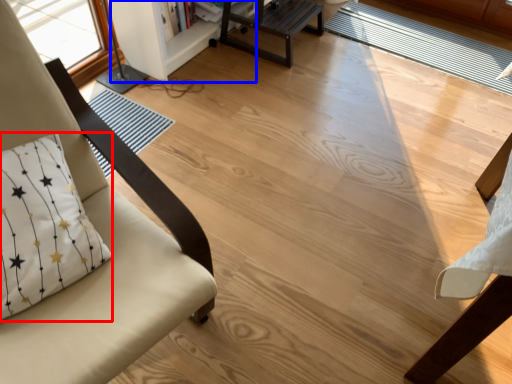
Question: Among these objects, which one is farthest to the camera, pillow (highlighted by a red box) or bookshelf (highlighted by a blue box)?

Choices:
 (A) pillow
 (B) bookshelf

Answer: (B)